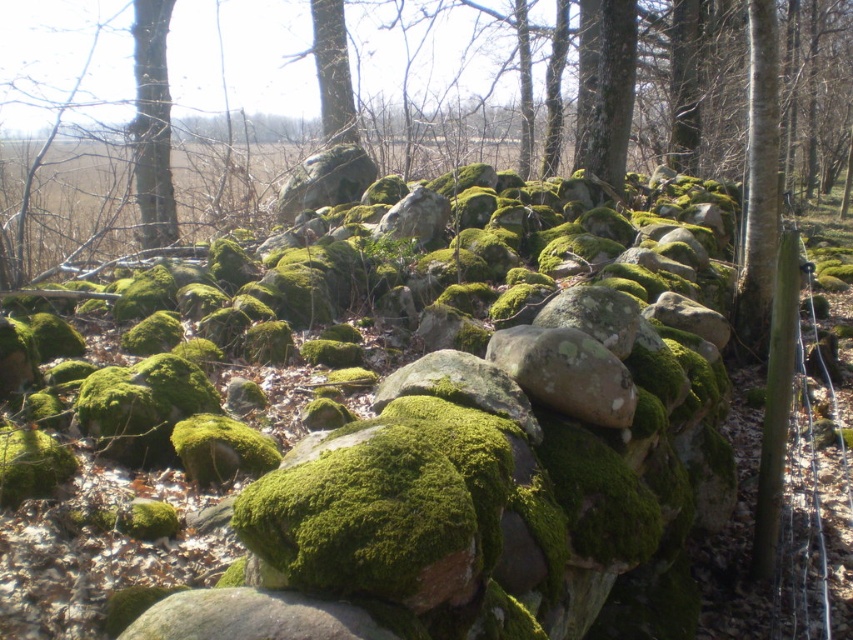
Question: Is green mossy rock at center to the left of smooth bark tree at left from the viewer's perspective?

Choices:
 (A) no
 (B) yes

Answer: (A)

Question: Considering the relative positions of green mossy rock at center and smooth bark tree at left in the image provided, where is green mossy rock at center located with respect to smooth bark tree at left?

Choices:
 (A) right
 (B) left

Answer: (A)

Question: Which object is farther from the camera taking this photo?

Choices:
 (A) smooth bark tree at left
 (B) green mossy rock at center

Answer: (A)

Question: Where is green mossy rock at center located in relation to smooth bark tree at left in the image?

Choices:
 (A) left
 (B) right

Answer: (B)

Question: Which object is closer to the camera taking this photo?

Choices:
 (A) smooth bark tree at left
 (B) green mossy rock at center

Answer: (B)